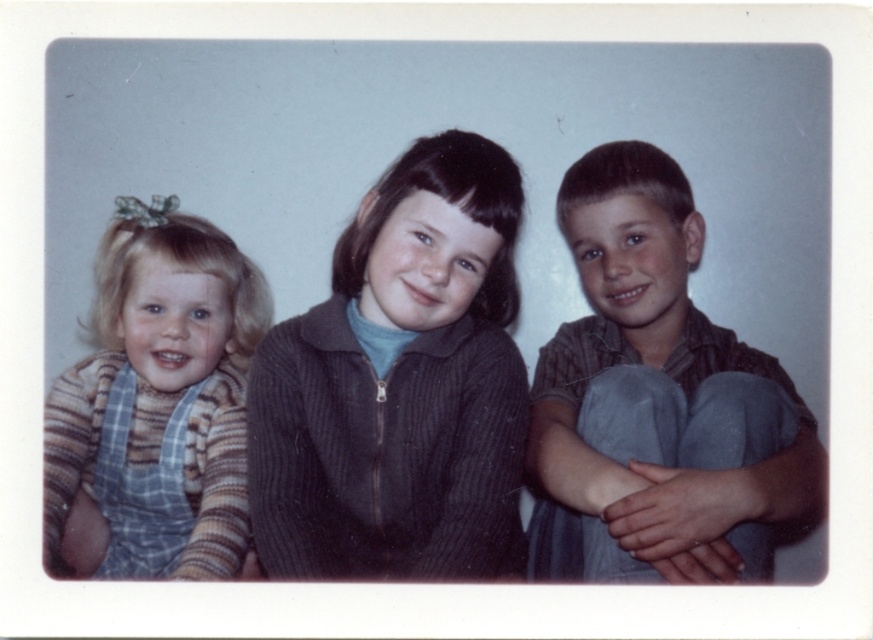
Question: Estimate the real-world distances between objects in this image. Which object is farther from the striped knit sweater at left?

Choices:
 (A) matte brown shirt at right
 (B) dark ribbed sweater at center

Answer: (A)

Question: Can you confirm if matte brown shirt at right is thinner than striped knit sweater at left?

Choices:
 (A) yes
 (B) no

Answer: (B)

Question: Is dark ribbed sweater at center smaller than striped knit sweater at left?

Choices:
 (A) no
 (B) yes

Answer: (B)

Question: Does matte brown shirt at right have a greater width compared to striped knit sweater at left?

Choices:
 (A) no
 (B) yes

Answer: (B)

Question: Which object is farther from the camera taking this photo?

Choices:
 (A) dark ribbed sweater at center
 (B) striped knit sweater at left

Answer: (B)

Question: Which object is the closest to the dark ribbed sweater at center?

Choices:
 (A) matte brown shirt at right
 (B) striped knit sweater at left

Answer: (A)